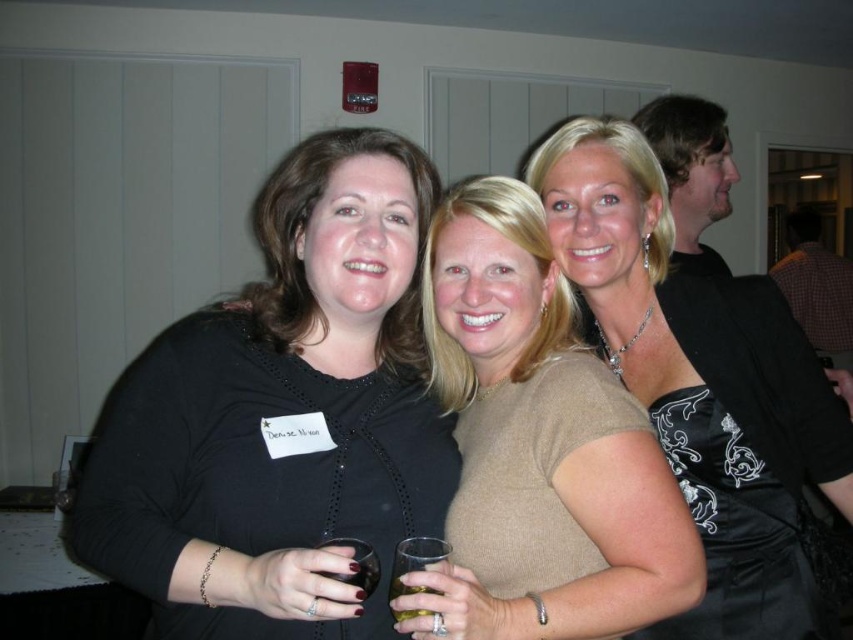
You are standing at the origin of the coordinate system in the room. You see two points marked in the image. Which point is closer to you, point (730, 522) or point (341, 547)?

Point (341, 547) is closer to you because it is in front of point (730, 522).